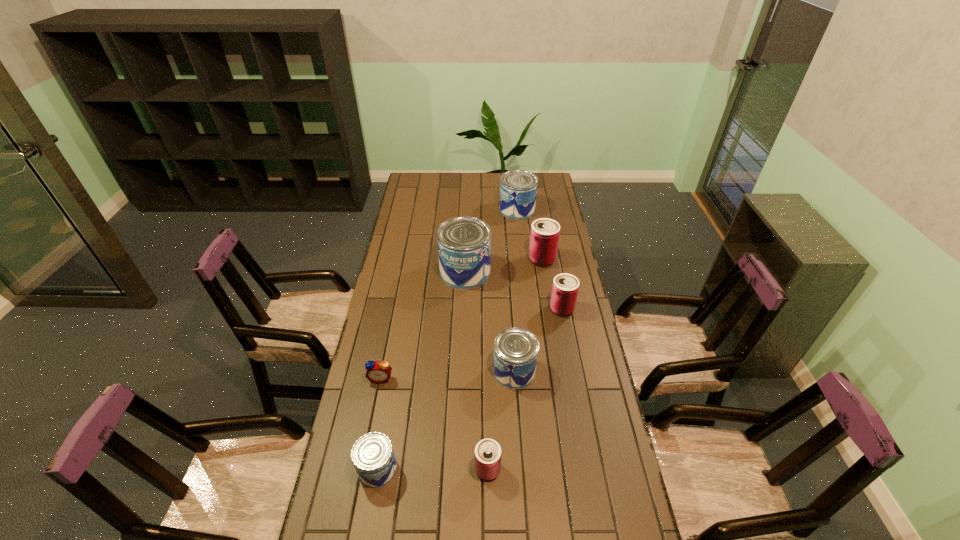
You are a GUI agent. You are given a task and a screenshot of the screen. Output one action in this format:
    pyautogui.click(x=<x>, y=<y>)
    Task: Click on the free region at the far left corner
    
    Given the screenshot: What is the action you would take?
    pyautogui.click(x=438, y=173)

The height and width of the screenshot is (540, 960). I want to click on vacant space at the far right corner of the desktop, so click(554, 181).

Identify the location of empty space that is in between the leftmost can and the second biggest pink can. (469, 389).

Find the location of a particular element. The width and height of the screenshot is (960, 540). vacant space that's between the fourth farthest object and the red alarm clock is located at coordinates (471, 343).

Find the location of a particular element. blank region between the third farthest blue can and the smallest blue can is located at coordinates (445, 420).

Locate an element on the screen. This screenshot has height=540, width=960. empty space between the second nearest pink can and the alarm clock is located at coordinates (471, 343).

Point out which object is positioned as the fifth nearest to the leftmost pink can. Please provide its 2D coordinates. Your answer should be formatted as a tuple, i.e. [(x, y)], where the tuple contains the x and y coordinates of a point satisfying the conditions above.

[(464, 243)]

Locate which object is the closest to the farthest blue can. Please provide its 2D coordinates. Your answer should be formatted as a tuple, i.e. [(x, y)], where the tuple contains the x and y coordinates of a point satisfying the conditions above.

[(544, 237)]

Identify which can is the third closest to the smallest pink can. Please provide its 2D coordinates. Your answer should be formatted as a tuple, i.e. [(x, y)], where the tuple contains the x and y coordinates of a point satisfying the conditions above.

[(565, 287)]

Image resolution: width=960 pixels, height=540 pixels. I want to click on can that is the fifth closest to the biggest pink can, so click(487, 456).